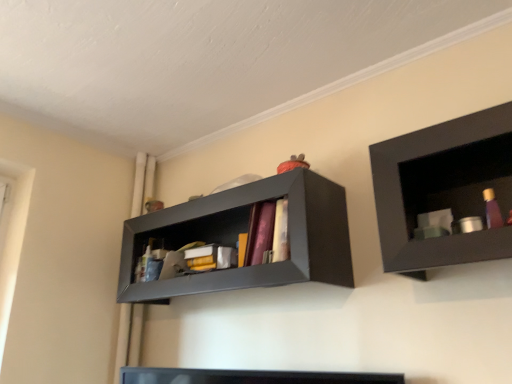
Question: Is matte black shelf at upper center, which ranks as the 2th shelf in right-to-left order, spatially inside matte black shelf at upper right, which is the second shelf from back to front, or outside of it?

Choices:
 (A) outside
 (B) inside

Answer: (A)

Question: Considering their positions, is matte black shelf at upper center, which is the 1th shelf in left-to-right order, located in front of or behind matte black shelf at upper right, marked as the first shelf in a right-to-left arrangement?

Choices:
 (A) front
 (B) behind

Answer: (B)

Question: Considering the positions of point (329, 274) and point (423, 129), is point (329, 274) closer or farther from the camera than point (423, 129)?

Choices:
 (A) farther
 (B) closer

Answer: (B)

Question: Is matte black shelf at upper right, the 2th shelf in the left-to-right sequence, wider or thinner than matte black shelf at upper center, which is the 1th shelf in left-to-right order?

Choices:
 (A) wide
 (B) thin

Answer: (B)

Question: From a real-world perspective, is matte black shelf at upper right, which is the second shelf from back to front, above or below matte black shelf at upper center, which ranks as the 2th shelf in right-to-left order?

Choices:
 (A) above
 (B) below

Answer: (B)

Question: Looking at the image, does matte black shelf at upper right, marked as the 1th shelf in a front-to-back arrangement, seem bigger or smaller compared to matte black shelf at upper center, which is the second shelf from front to back?

Choices:
 (A) big
 (B) small

Answer: (B)

Question: Based on their positions, is matte black shelf at upper right, the 2th shelf in the left-to-right sequence, located to the left or right of matte black shelf at upper center, which ranks as the 2th shelf in right-to-left order?

Choices:
 (A) left
 (B) right

Answer: (B)